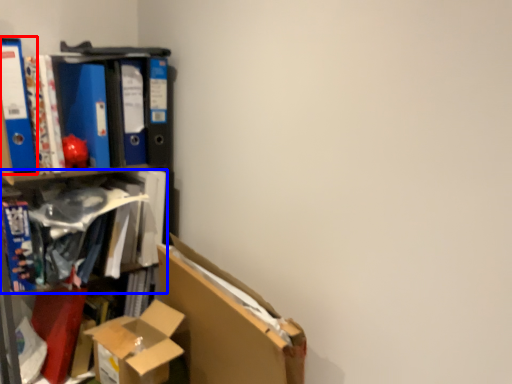
Question: Which object is closer to the camera taking this photo, paperback book (highlighted by a red box) or book (highlighted by a blue box)?

Choices:
 (A) paperback book
 (B) book

Answer: (A)